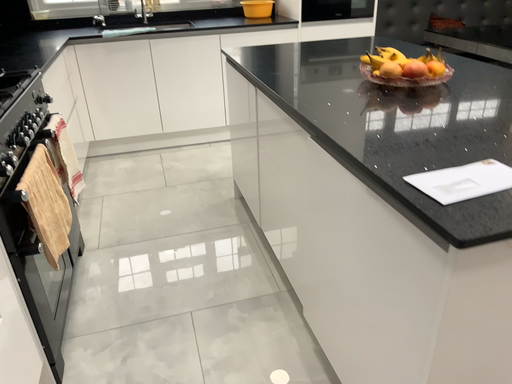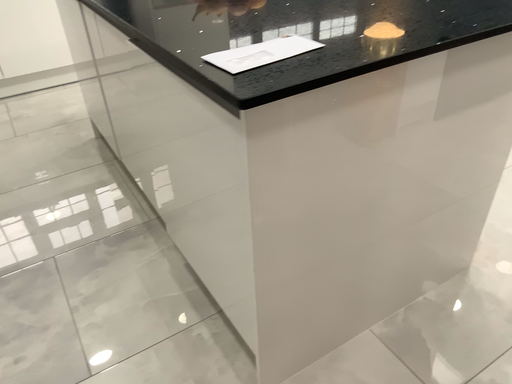
Question: Which way did the camera rotate in the video?

Choices:
 (A) rotated downward
 (B) rotated upward

Answer: (A)